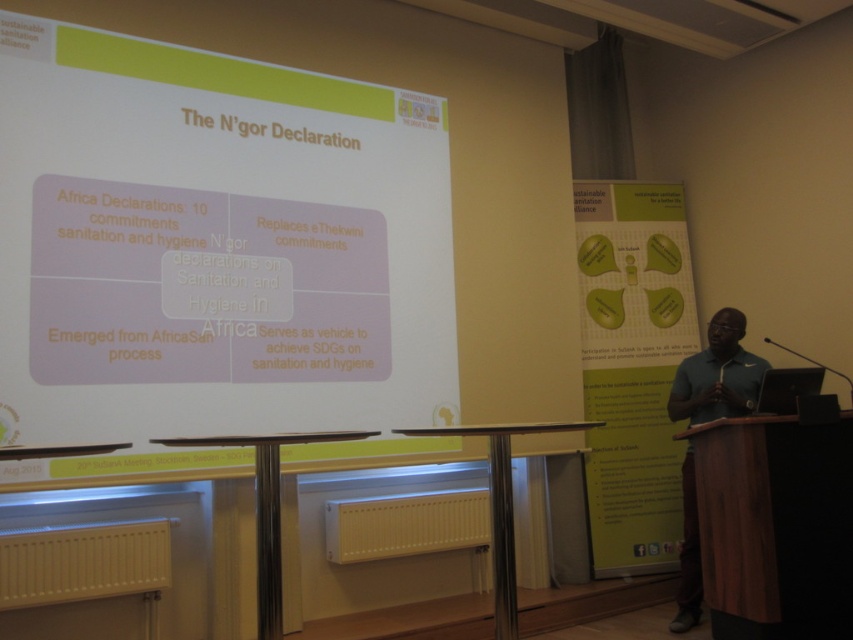
Is white matte projection screen at upper center positioned before dark green polo shirt at right?

Yes, it is.

Between white matte projection screen at upper center and dark green polo shirt at right, which one is positioned lower?

dark green polo shirt at right is lower down.

I want to click on white matte projection screen at upper center, so [213, 252].